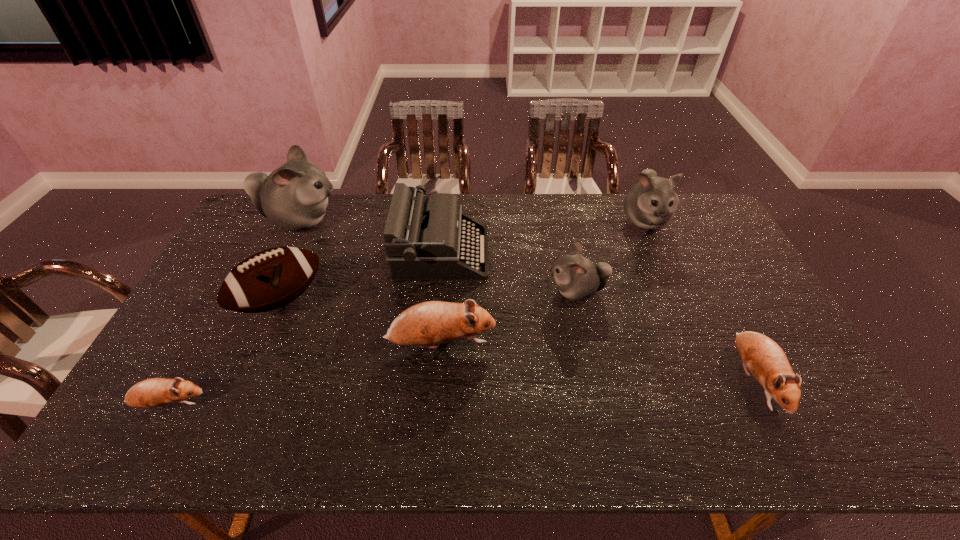
Find the location of a particular element. the seventh tallest object is located at coordinates (767, 362).

Where is `the second shortest hamster`? The image size is (960, 540). the second shortest hamster is located at coordinates (767, 362).

Where is `the shortest hamster`? The width and height of the screenshot is (960, 540). the shortest hamster is located at coordinates (154, 392).

Locate an element on the screen. the smallest brown hamster is located at coordinates (154, 392).

Where is `vacant space located 0.060m on the face of the biggest white hamster`? This screenshot has height=540, width=960. vacant space located 0.060m on the face of the biggest white hamster is located at coordinates (358, 221).

Image resolution: width=960 pixels, height=540 pixels. I want to click on free space located 0.340m on the face of the second biggest white hamster, so click(686, 317).

This screenshot has width=960, height=540. I want to click on free space located 0.380m on the typing side of the typewriter, so click(x=601, y=252).

You are a GUI agent. You are given a task and a screenshot of the screen. Output one action in this format:
    pyautogui.click(x=<x>, y=<y>)
    Task: Click on the vacant space located 0.370m on the right of the football (American)
    
    Given the screenshot: What is the action you would take?
    pyautogui.click(x=443, y=300)

Where is `free region located 0.210m on the face of the fourth nearest hamster`? The width and height of the screenshot is (960, 540). free region located 0.210m on the face of the fourth nearest hamster is located at coordinates (479, 291).

Identify the location of vacant space situated on the face of the fourth nearest hamster. The width and height of the screenshot is (960, 540). (492, 291).